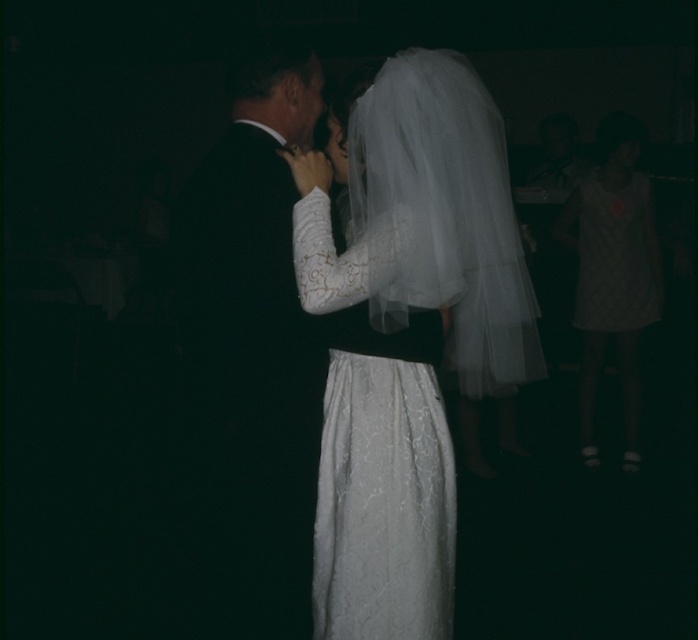
You are a photographer at the wedding and need to position yourself to capture both the white lace dress at center and the white quilted dress at right in a single shot. Considering their sizes, which dress should you focus on to ensure both are visible without cropping?

The white lace dress at center is thinner than the white quilted dress at right, so focusing on the white lace dress at center would allow the wider white quilted dress at right to fit into the frame as well.

You are a photographer at the wedding and want to capture a closeup shot of the couple. You have two points marked in the image for focus. Point A is at coordinates point (289, 541) and point B is at coordinates point (584, 253). Which point should you focus on to get a clearer image of the couple?

Point A at coordinates point (289, 541) is closer to the viewer than point B at coordinates point (584, 253). Therefore, focusing on point A will provide a clearer image of the couple since it is nearer to the camera.

Consider the image. You are a photographer at a wedding. You notice the white lace dress at center and the white quilted dress at right. Which dress is positioned lower in the image?

The white lace dress at center is located below the white quilted dress at right, so it is positioned lower in the image.